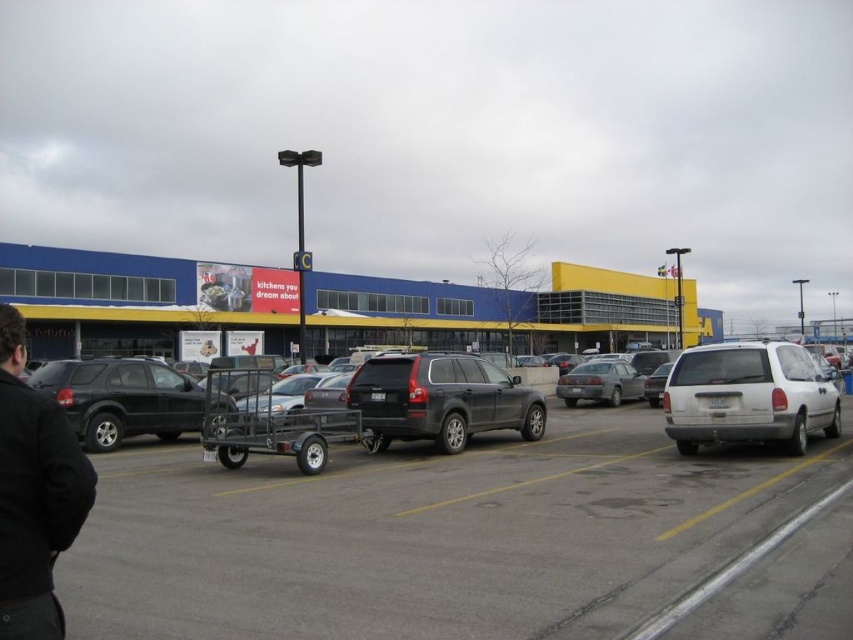
Which of these two, black fabric jacket at lower left or matte black suv at left, stands taller?

Standing taller between the two is matte black suv at left.

Describe the element at coordinates (33, 493) in the screenshot. I see `black fabric jacket at lower left` at that location.

The width and height of the screenshot is (853, 640). In order to click on black fabric jacket at lower left in this screenshot , I will do `click(33, 493)`.

Measure the distance between point (x=386, y=620) and camera.

Point (x=386, y=620) is 4.79 meters from camera.

Can you confirm if black metal trailer at center is wider than matte black trailer at center?

No.

The width and height of the screenshot is (853, 640). Find the location of `black metal trailer at center`. black metal trailer at center is located at coordinates (465, 540).

Does black metal trailer at center appear on the left side of silver metallic sedan at center?

Indeed, black metal trailer at center is positioned on the left side of silver metallic sedan at center.

Does point (767, 584) come in front of point (560, 384)?

Yes, point (767, 584) is in front of point (560, 384).

Is point (439, 548) less distant than point (595, 374)?

Yes, it is in front of point (595, 374).

Identify the location of black metal trailer at center. The width and height of the screenshot is (853, 640). (465, 540).